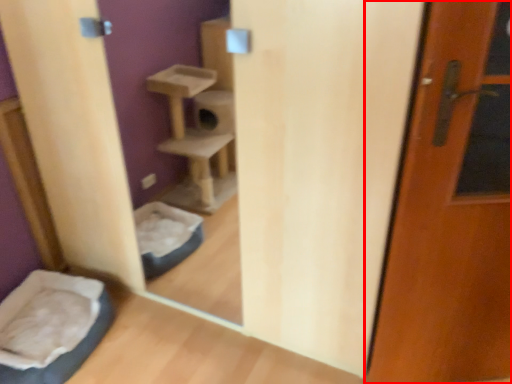
Question: From the image's perspective, where is door (annotated by the red box) located in relation to wide in the image?

Choices:
 (A) above
 (B) below

Answer: (A)